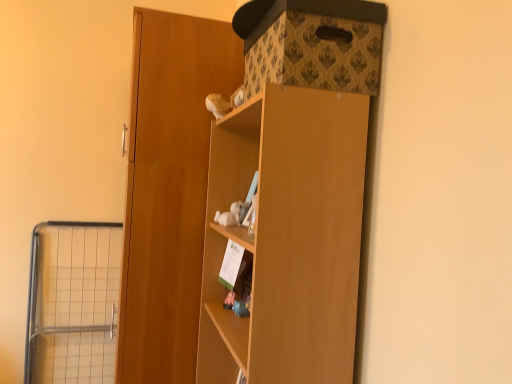
Question: Should I look upward or downward to see metal wire cage at left?

Choices:
 (A) down
 (B) up

Answer: (A)

Question: From a real-world perspective, does wooden door at center stand above metal wire cage at left?

Choices:
 (A) yes
 (B) no

Answer: (A)

Question: Is wooden door at center located outside metal wire cage at left?

Choices:
 (A) no
 (B) yes

Answer: (B)

Question: Is wooden door at center beside metal wire cage at left?

Choices:
 (A) no
 (B) yes

Answer: (A)

Question: Is the depth of wooden door at center greater than that of metal wire cage at left?

Choices:
 (A) no
 (B) yes

Answer: (A)

Question: From the image's perspective, is wooden door at center on top of metal wire cage at left?

Choices:
 (A) no
 (B) yes

Answer: (B)

Question: Considering the relative sizes of wooden door at center and metal wire cage at left in the image provided, is wooden door at center wider than metal wire cage at left?

Choices:
 (A) yes
 (B) no

Answer: (A)

Question: Is metal wire cage at left in contact with wooden door at center?

Choices:
 (A) yes
 (B) no

Answer: (B)

Question: Considering the relative sizes of metal wire cage at left and wooden door at center in the image provided, is metal wire cage at left thinner than wooden door at center?

Choices:
 (A) yes
 (B) no

Answer: (A)

Question: Does metal wire cage at left have a greater width compared to wooden door at center?

Choices:
 (A) no
 (B) yes

Answer: (A)

Question: From the image's perspective, is metal wire cage at left located above wooden door at center?

Choices:
 (A) no
 (B) yes

Answer: (A)

Question: Does metal wire cage at left have a lesser height compared to wooden door at center?

Choices:
 (A) no
 (B) yes

Answer: (B)

Question: Is metal wire cage at left facing towards wooden door at center?

Choices:
 (A) no
 (B) yes

Answer: (A)

Question: Are wooden door at center and patterned cardboard storage box at upper right far apart?

Choices:
 (A) yes
 (B) no

Answer: (B)